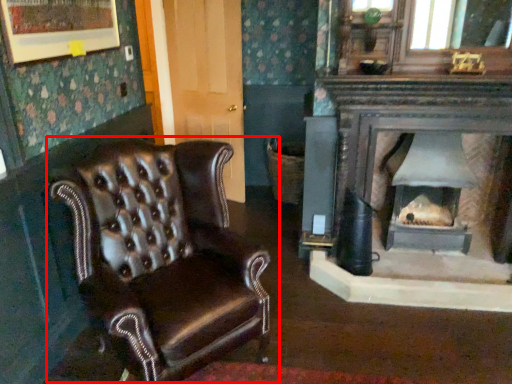
Question: From the image's perspective, where is chair (annotated by the red box) located in relation to wood burning stove in the image?

Choices:
 (A) below
 (B) above

Answer: (A)